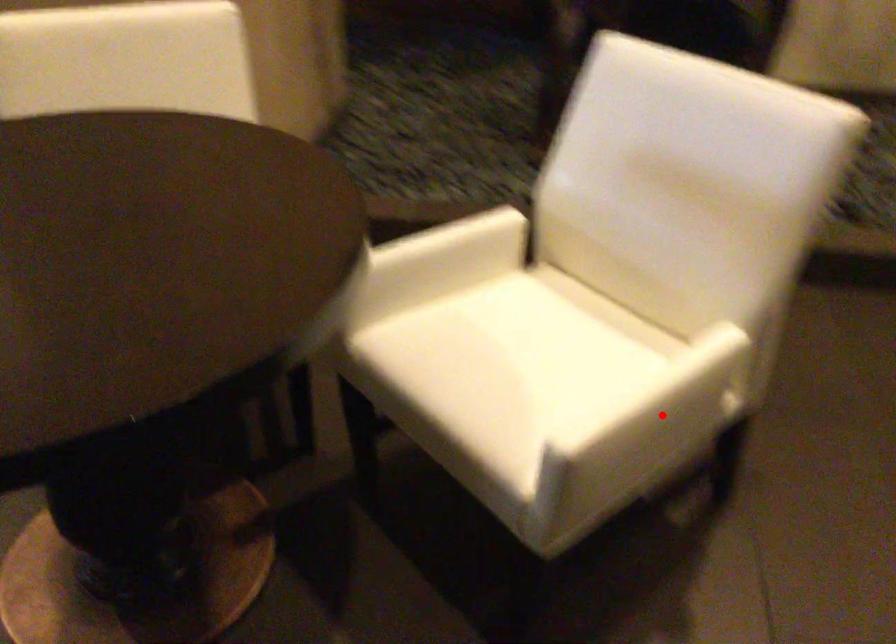
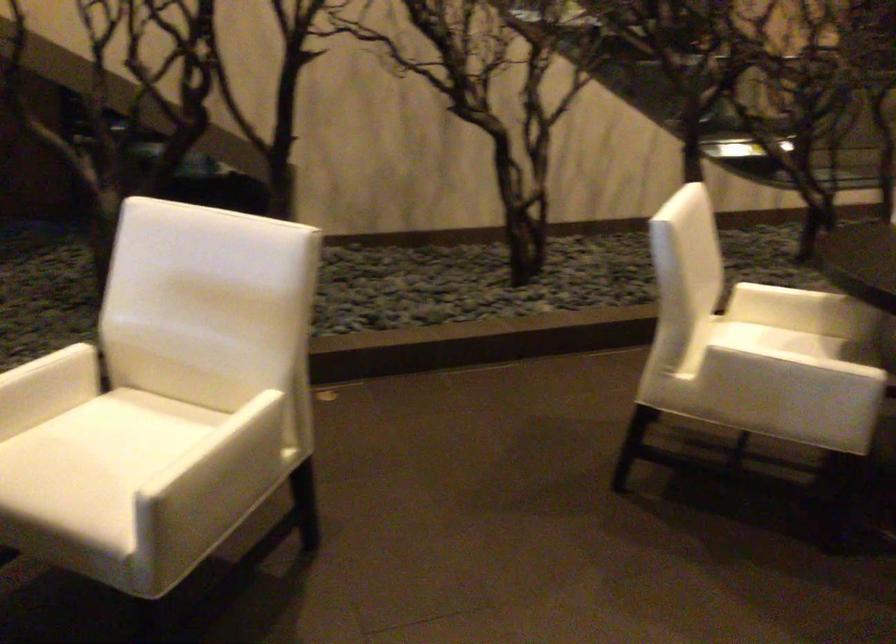
Question: I am providing you with two images of the same scene from different viewpoints. Image1 has a red point marked. In image2, the corresponding 3D location appears at what relative position? Reply with the corresponding letter.

Choices:
 (A) Closer
 (B) Farther

Answer: (B)